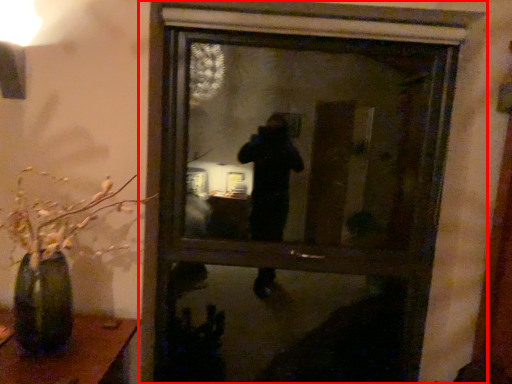
Question: From the image's perspective, where is window (annotated by the red box) located in relation to houseplant in the image?

Choices:
 (A) above
 (B) below

Answer: (A)